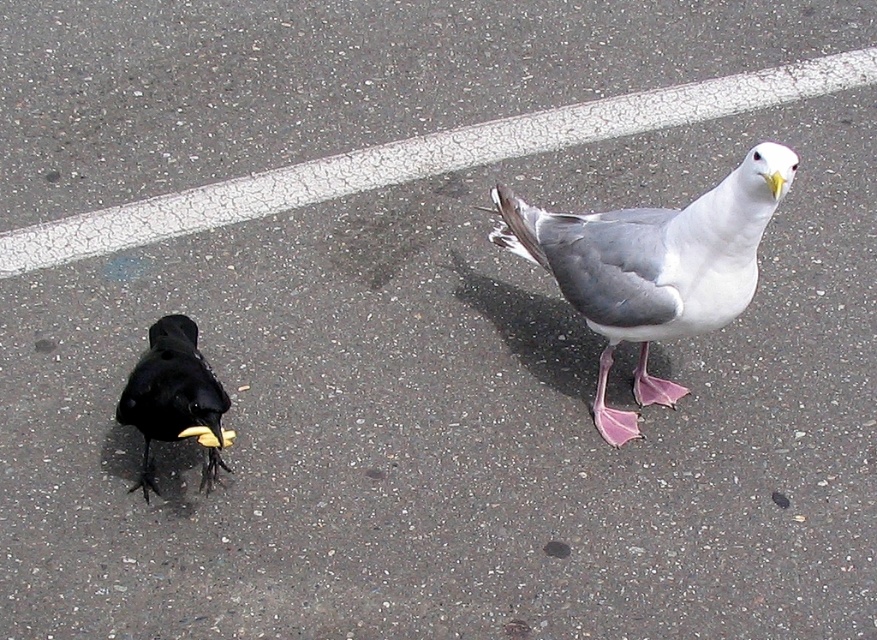
Question: Is white matte/grey seagull at right behind shiny black pigeon at lower left?

Choices:
 (A) yes
 (B) no

Answer: (B)

Question: Is white matte/grey seagull at right below shiny black pigeon at lower left?

Choices:
 (A) no
 (B) yes

Answer: (A)

Question: Which object appears closest to the camera in this image?

Choices:
 (A) shiny black pigeon at lower left
 (B) white matte/grey seagull at right

Answer: (B)

Question: Can you confirm if white matte/grey seagull at right is positioned below shiny black pigeon at lower left?

Choices:
 (A) no
 (B) yes

Answer: (A)